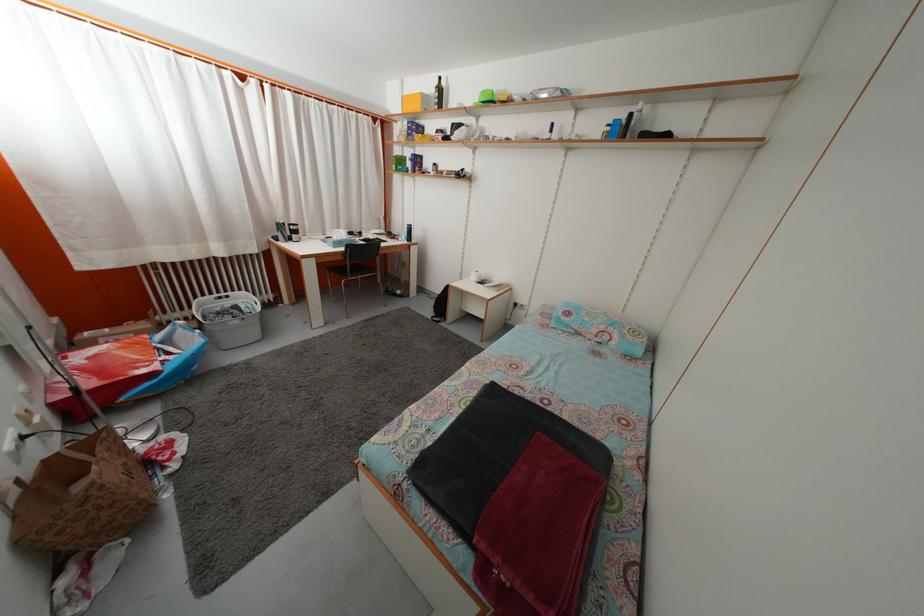
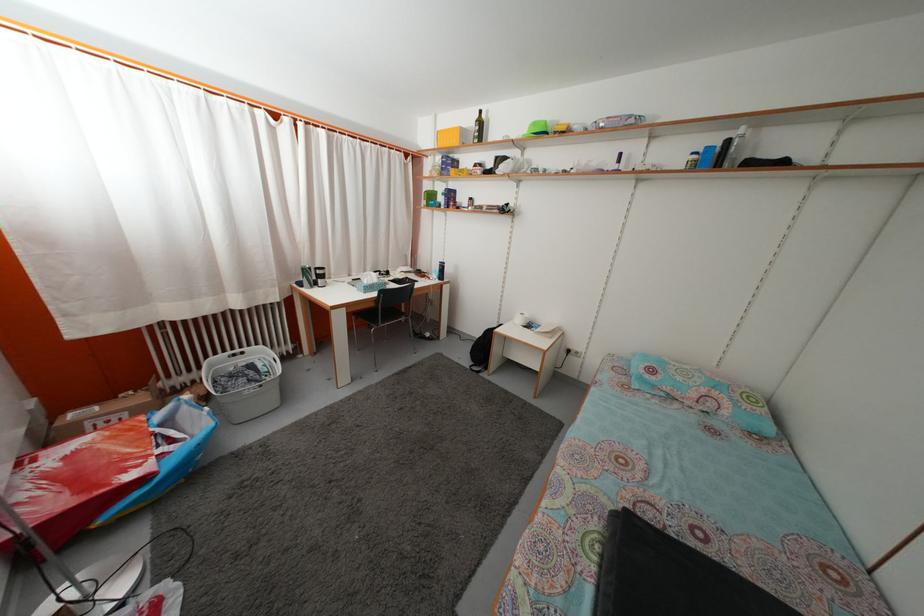
In the second image, find the point that corresponds to pixel 434 92 in the first image.

(475, 127)